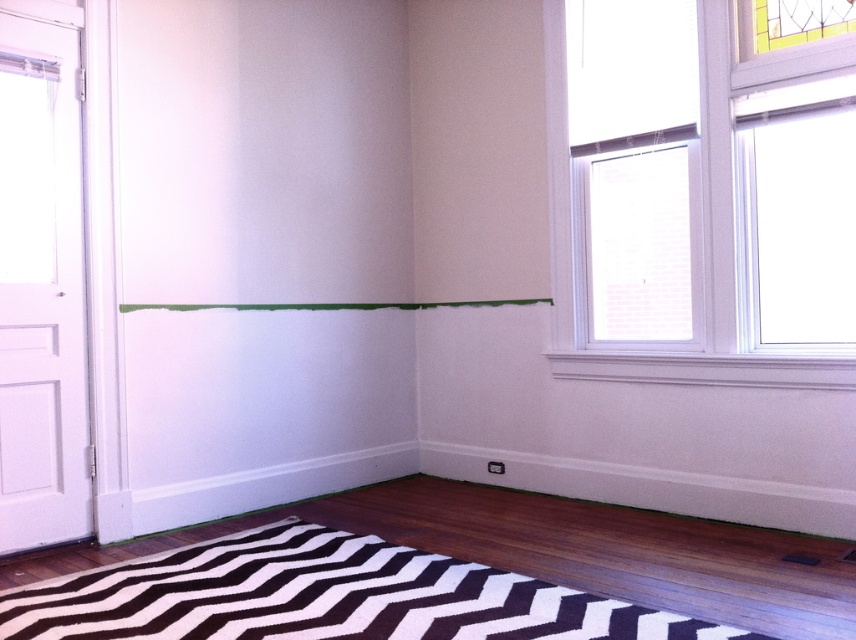
Who is positioned more to the left, black and white zigzag rug at lower center or white glass window at upper right?

From the viewer's perspective, black and white zigzag rug at lower center appears more on the left side.

Is black and white zigzag rug at lower center below white glass window at upper right?

Correct, black and white zigzag rug at lower center is located below white glass window at upper right.

This screenshot has width=856, height=640. Describe the element at coordinates (324, 596) in the screenshot. I see `black and white zigzag rug at lower center` at that location.

Identify the location of black and white zigzag rug at lower center. The image size is (856, 640). (324, 596).